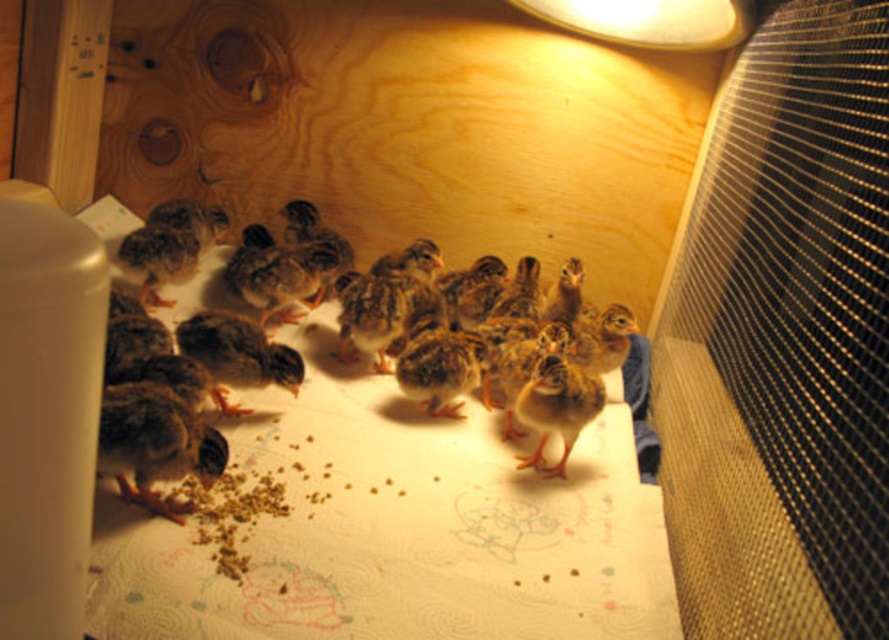
From the picture: You are a caretaker of the baby chicks in the brooder box. You need to adjust the heat lamp to ensure it is positioned correctly. The recommended distance between the heat source and the chicks should be at least 12 inches. Can you confirm if the current distance between the black mesh screen at right and the metallic silver lampshade at upper center meets this requirement?

The black mesh screen at right and metallic silver lampshade at upper center are 14.49 inches apart, which exceeds the recommended minimum distance of 12 inches. Therefore, the current distance meets the requirement.

You are a farmer checking on your baby chicks. You notice the brown speckled chicks at center and the metallic silver lampshade at upper center. Which object is closer to you?

The brown speckled chicks at center are closer to you than the metallic silver lampshade at upper center.

You are a farmer checking the brooder box for the baby chicks. You notice the black mesh screen at right and the metallic silver lampshade at upper center. Which object is located to the right of the other?

The black mesh screen at right is positioned on the right side of metallic silver lampshade at upper center, so the black mesh screen at right is to the right of the metallic silver lampshade at upper center.